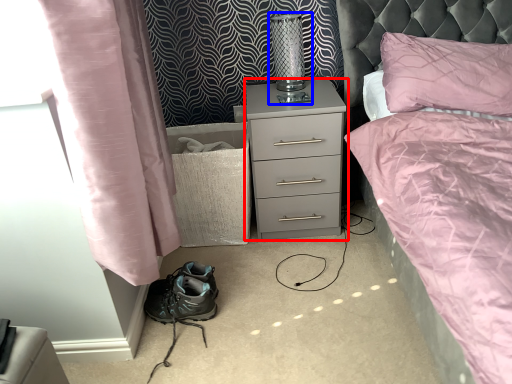
Question: Which of the following is the farthest to the observer, nightstand (highlighted by a red box) or bedside lamp (highlighted by a blue box)?

Choices:
 (A) nightstand
 (B) bedside lamp

Answer: (B)